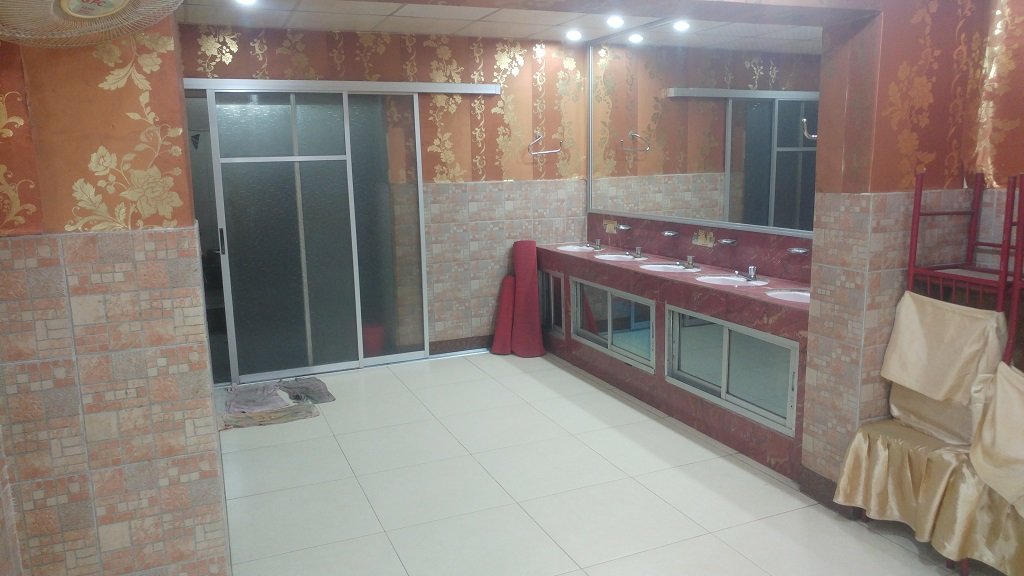
You are a GUI agent. You are given a task and a screenshot of the screen. Output one action in this format:
    pyautogui.click(x=<x>, y=<y>)
    Task: Click on the sinks
    
    Given the screenshot: What is the action you would take?
    pyautogui.click(x=577, y=249), pyautogui.click(x=615, y=253), pyautogui.click(x=657, y=270), pyautogui.click(x=726, y=280), pyautogui.click(x=781, y=295)